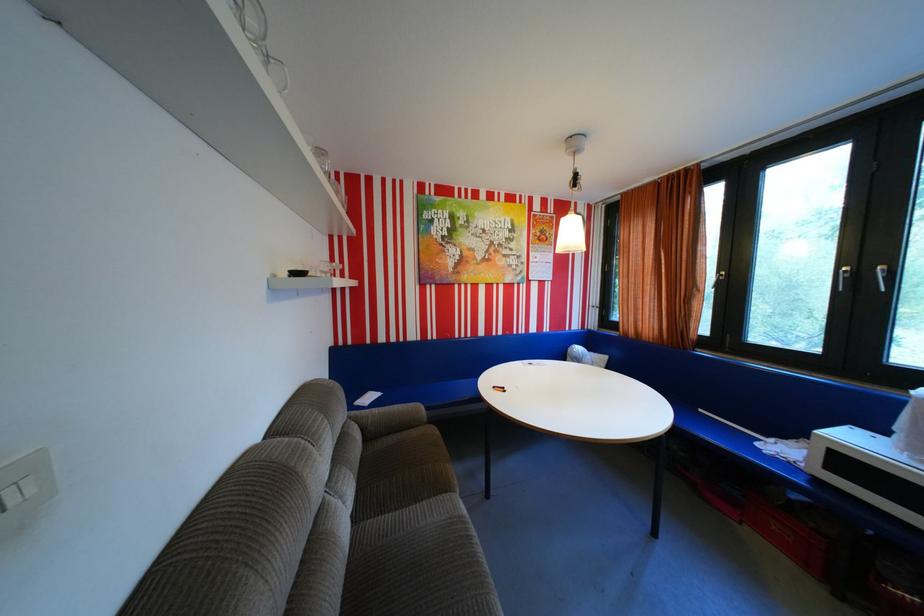
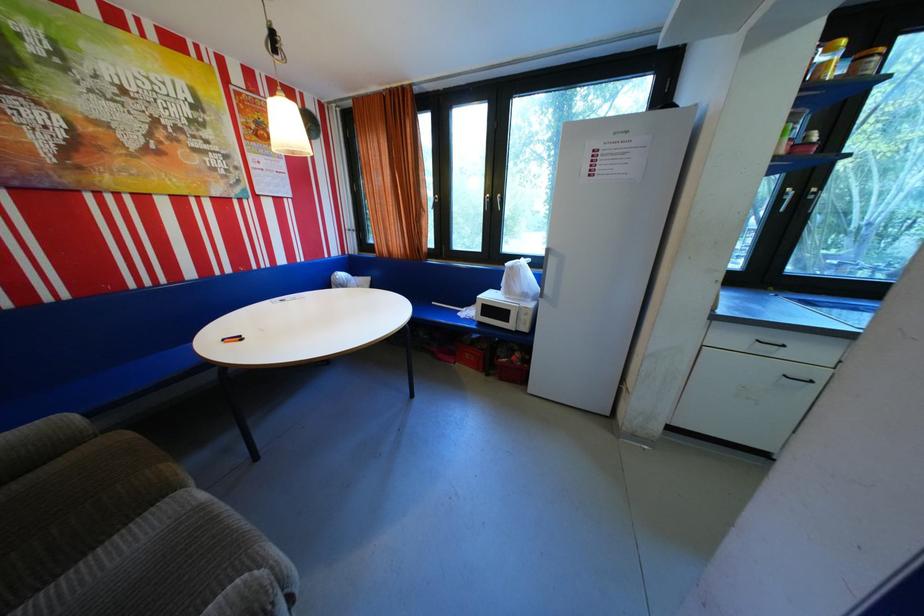
In the second image, find the point that corresponds to point 446,430 in the first image.

(137, 436)